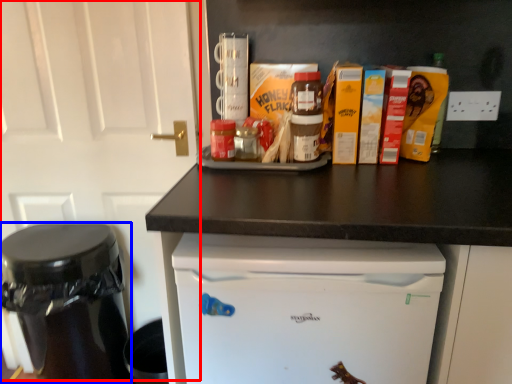
Question: Which object appears farthest to the camera in this image, door (highlighted by a red box) or appliance (highlighted by a blue box)?

Choices:
 (A) door
 (B) appliance

Answer: (B)